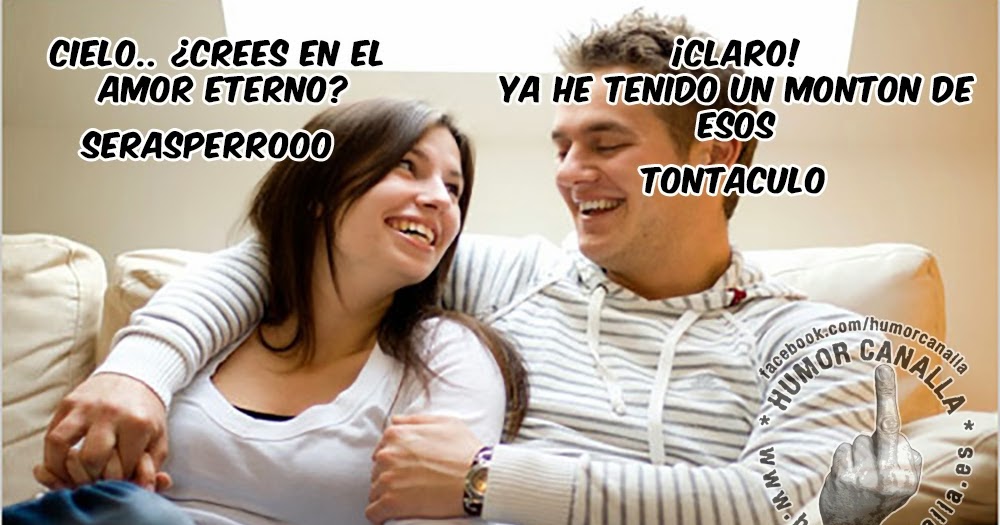
You are a GUI agent. You are given a task and a screenshot of the screen. Output one action in this format:
    pyautogui.click(x=<x>, y=<y>)
    Task: Click on the light
    Image resolution: width=1000 pixels, height=525 pixels.
    Given the screenshot: What is the action you would take?
    pyautogui.click(x=463, y=31)